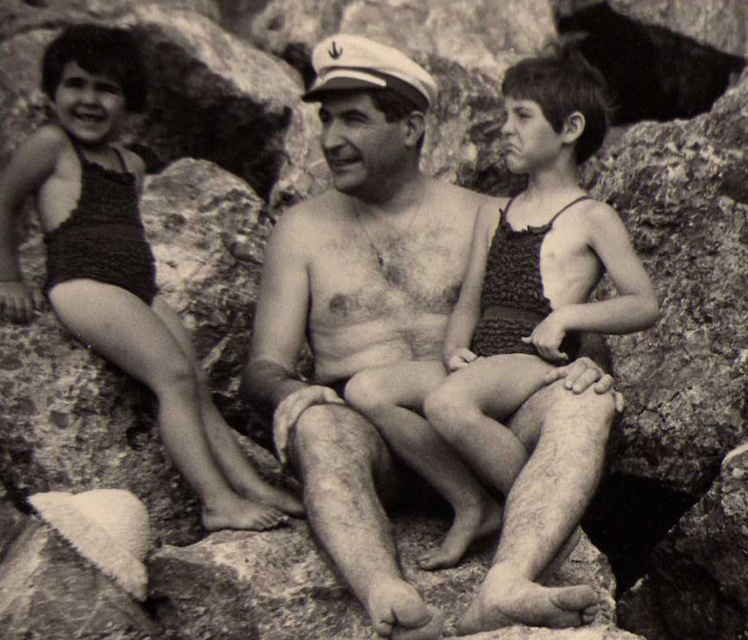
Is point (459, 209) positioned behind point (506, 376)?

That is True.

Between smooth skin man at center and textured fabric swimsuit at center, which one is positioned higher?

textured fabric swimsuit at center

What do you see at coordinates (401, 358) in the screenshot? The image size is (748, 640). I see `smooth skin man at center` at bounding box center [401, 358].

This screenshot has width=748, height=640. What are the coordinates of `smooth skin man at center` in the screenshot? It's located at (401, 358).

Does smooth skin man at center appear on the right side of crochet fabric swimsuit at left?

Correct, you'll find smooth skin man at center to the right of crochet fabric swimsuit at left.

The width and height of the screenshot is (748, 640). I want to click on smooth skin man at center, so click(401, 358).

Does textured fabric swimsuit at center appear on the left side of crochet fabric swimsuit at left?

In fact, textured fabric swimsuit at center is to the right of crochet fabric swimsuit at left.

Is textured fabric swimsuit at center bigger than crochet fabric swimsuit at left?

No, textured fabric swimsuit at center is not bigger than crochet fabric swimsuit at left.

Who is more distant from viewer, (502, 268) or (230, 493)?

The point (502, 268) is more distant.

Image resolution: width=748 pixels, height=640 pixels. I want to click on textured fabric swimsuit at center, so click(536, 273).